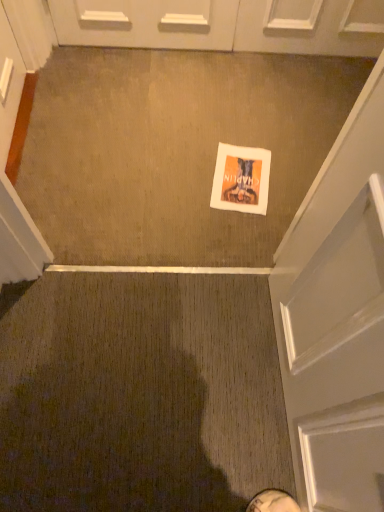
The width and height of the screenshot is (384, 512). I want to click on vacant area on top of white paper flyer at center (from a real-world perspective), so click(238, 170).